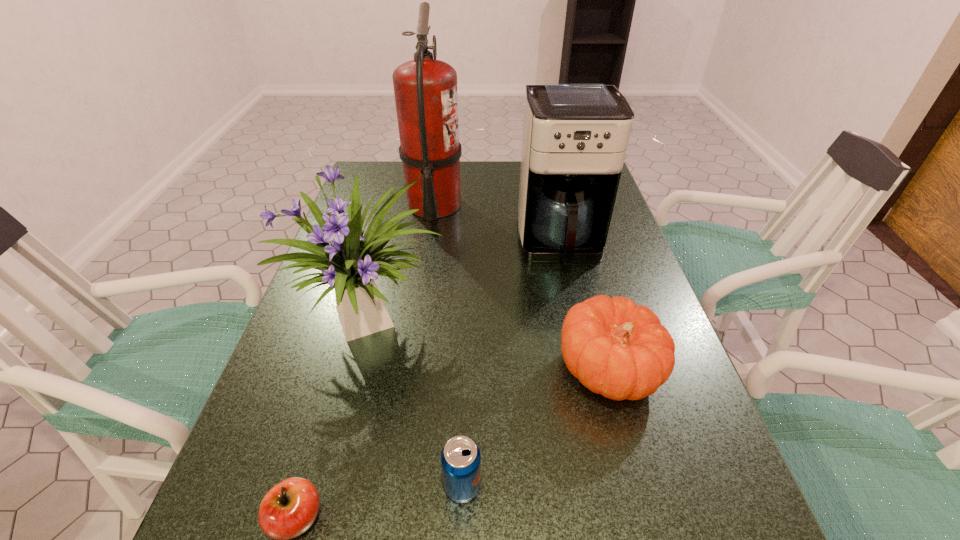
The width and height of the screenshot is (960, 540). I want to click on object at the far edge, so click(x=425, y=89).

Find the location of `object that is at the left edge`. object that is at the left edge is located at coordinates (351, 262).

The image size is (960, 540). I want to click on coffee maker present at the right edge, so click(x=575, y=135).

This screenshot has height=540, width=960. Find the location of `pumpkin that is at the right edge`. pumpkin that is at the right edge is located at coordinates (615, 348).

You are a GUI agent. You are given a task and a screenshot of the screen. Output one action in this format:
    pyautogui.click(x=<x>, y=<y>)
    Task: Click on the free spot at the far edge of the desktop
    The height and width of the screenshot is (540, 960).
    Given the screenshot: What is the action you would take?
    pyautogui.click(x=475, y=164)

The image size is (960, 540). What are the coordinates of `vacant space at the left edge of the desktop` in the screenshot? It's located at (333, 340).

Identify the location of vacant position at the right edge of the desktop. The width and height of the screenshot is (960, 540). [652, 455].

The image size is (960, 540). In order to click on blank region between the flower arrangement and the coffee maker in this screenshot , I will do `click(467, 284)`.

This screenshot has width=960, height=540. In order to click on vacant space that is in between the pumpkin and the flower arrangement in this screenshot , I will do `click(491, 346)`.

I want to click on empty space that is in between the fourth tallest object and the flower arrangement, so click(x=491, y=346).